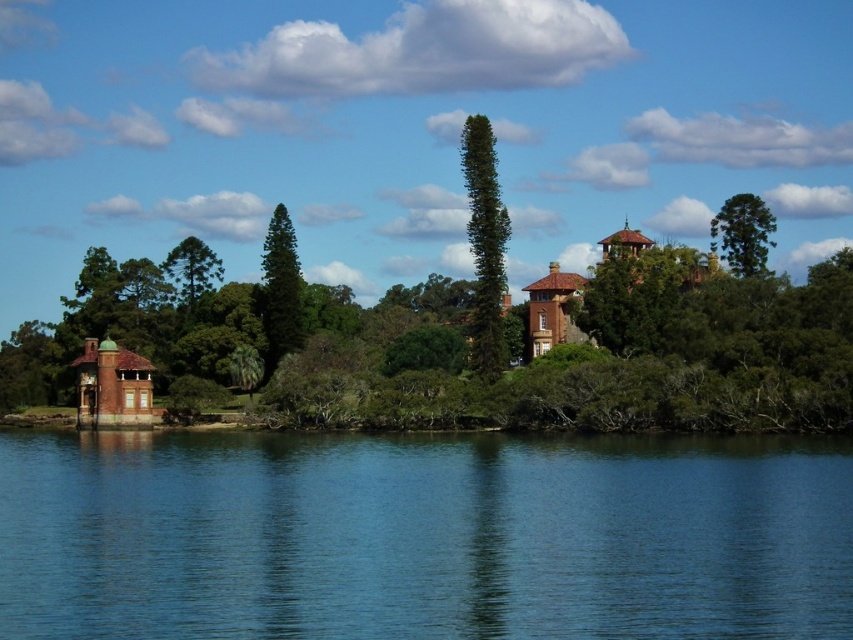
You are standing at the lakeside and want to take a photo of both the green textured tree at center and the green glossy tree at center. Which tree should you focus on first to ensure both are in clear view?

You should focus on the green textured tree at center first because it is closer to you than the green glossy tree at center, so adjusting focus from near to far will help capture both clearly.

You are an artist planning to paint the lakeside scene. You need to decide which area to focus on first based on their visual prominence. Which object should you paint first, the transparent blue water at center or the green textured tree at upper right?

The green textured tree at upper right occupies more space than the transparent blue water at center, so you should paint the green textured tree at upper right first to establish its prominence in the composition.